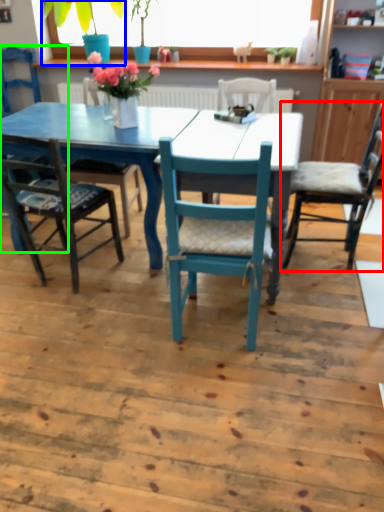
Question: Considering the real-world distances, which object is closest to chair (highlighted by a red box)? houseplant (highlighted by a blue box) or chair (highlighted by a green box).

Choices:
 (A) houseplant
 (B) chair

Answer: (A)